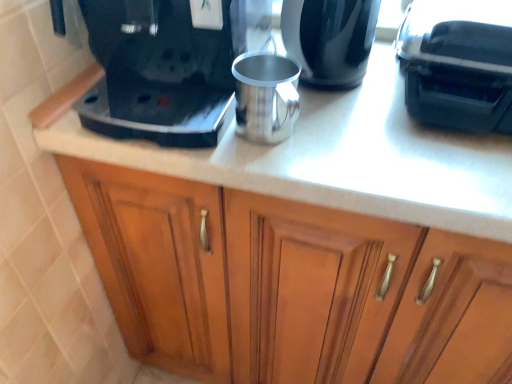
Identify the location of vacant space to the left of polished metal mug at center. The width and height of the screenshot is (512, 384). (172, 140).